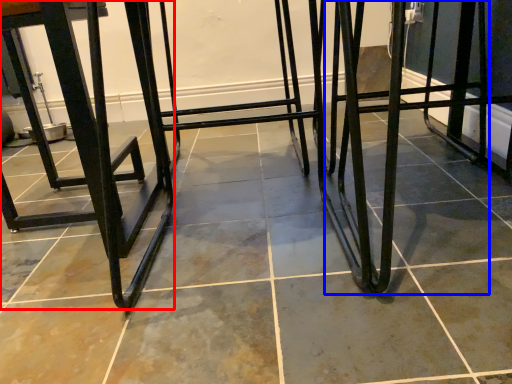
Question: Which of the following is the farthest to the observer, furniture (highlighted by a red box) or step stool (highlighted by a blue box)?

Choices:
 (A) furniture
 (B) step stool

Answer: (A)